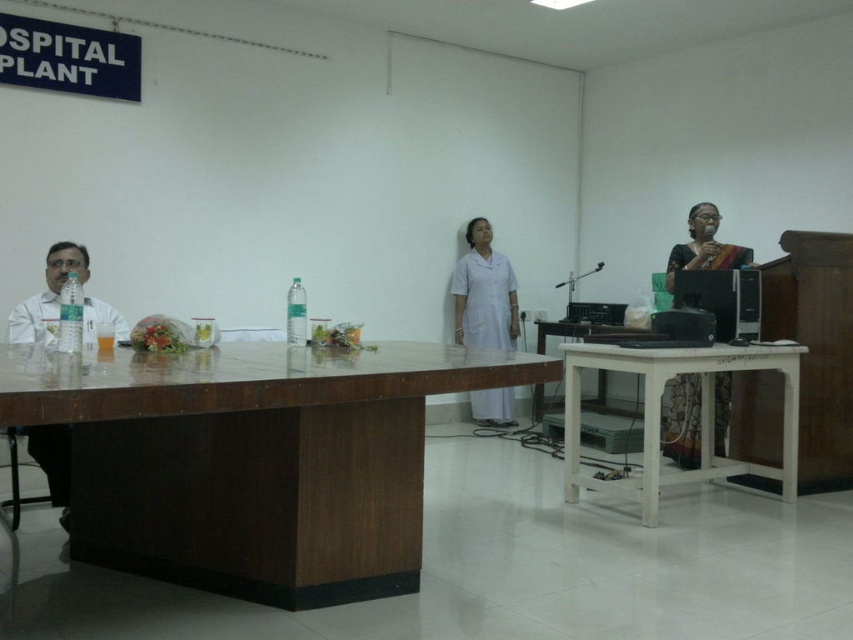
Question: In this image, where is white smooth uniform at center located relative to white glossy table at center?

Choices:
 (A) below
 (B) above

Answer: (B)

Question: Among these points, which one is farthest from the camera?

Choices:
 (A) [x=65, y=388]
 (B) [x=469, y=406]
 (C) [x=709, y=227]

Answer: (B)

Question: Which object is closer to the camera taking this photo?

Choices:
 (A) white wooden table at lower right
 (B) silk saree at right

Answer: (A)

Question: Does white smooth uniform at center have a larger size compared to silk saree at right?

Choices:
 (A) no
 (B) yes

Answer: (B)

Question: Which point is farther from the camera taking this photo?

Choices:
 (A) (683, 472)
 (B) (454, 292)
 (C) (131, 570)
 (D) (697, 460)

Answer: (B)

Question: Observing the image, what is the correct spatial positioning of brown wood table at center in reference to white smooth uniform at center?

Choices:
 (A) below
 (B) above

Answer: (A)